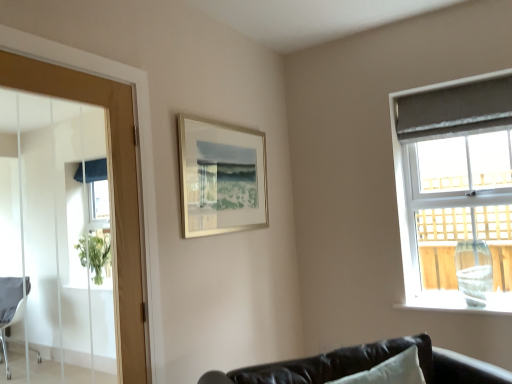
Question: Considering the relative positions of wooden door at left and matte gray curtain at right in the image provided, is wooden door at left to the left of matte gray curtain at right from the viewer's perspective?

Choices:
 (A) yes
 (B) no

Answer: (A)

Question: Does wooden door at left have a lesser width compared to matte gray curtain at right?

Choices:
 (A) no
 (B) yes

Answer: (B)

Question: Does wooden door at left turn towards matte gray curtain at right?

Choices:
 (A) no
 (B) yes

Answer: (A)

Question: Considering the relative sizes of wooden door at left and matte gray curtain at right in the image provided, is wooden door at left smaller than matte gray curtain at right?

Choices:
 (A) no
 (B) yes

Answer: (B)

Question: Is matte gray curtain at right completely or partially inside wooden door at left?

Choices:
 (A) no
 (B) yes

Answer: (A)

Question: In the image, is gray fabric curtain at upper right positioned in front of or behind wooden door at left?

Choices:
 (A) front
 (B) behind

Answer: (B)

Question: From a real-world perspective, relative to wooden door at left, is gray fabric curtain at upper right vertically above or below?

Choices:
 (A) below
 (B) above

Answer: (B)

Question: Considering the relative positions of gray fabric curtain at upper right and wooden door at left in the image provided, is gray fabric curtain at upper right to the left or to the right of wooden door at left?

Choices:
 (A) left
 (B) right

Answer: (B)

Question: From the image's perspective, is gray fabric curtain at upper right above or below wooden door at left?

Choices:
 (A) above
 (B) below

Answer: (A)

Question: From the image's perspective, is silver metallic picture frame at upper center positioned above or below matte gray curtain at right?

Choices:
 (A) above
 (B) below

Answer: (A)

Question: Based on their positions, is silver metallic picture frame at upper center located to the left or right of matte gray curtain at right?

Choices:
 (A) right
 (B) left

Answer: (B)

Question: Looking at their shapes, would you say silver metallic picture frame at upper center is wider or thinner than matte gray curtain at right?

Choices:
 (A) wide
 (B) thin

Answer: (B)

Question: Is silver metallic picture frame at upper center spatially inside matte gray curtain at right, or outside of it?

Choices:
 (A) inside
 (B) outside

Answer: (B)

Question: Considering the positions of wooden door at left and matte gray curtain at right in the image, is wooden door at left bigger or smaller than matte gray curtain at right?

Choices:
 (A) small
 (B) big

Answer: (A)

Question: Would you say wooden door at left is inside or outside matte gray curtain at right?

Choices:
 (A) inside
 (B) outside

Answer: (B)